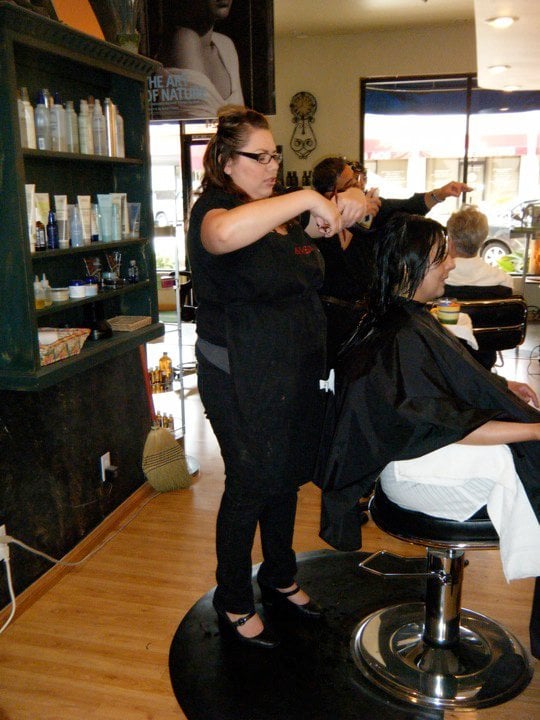
Identify the location of wood floor. The width and height of the screenshot is (540, 720). (175, 523).